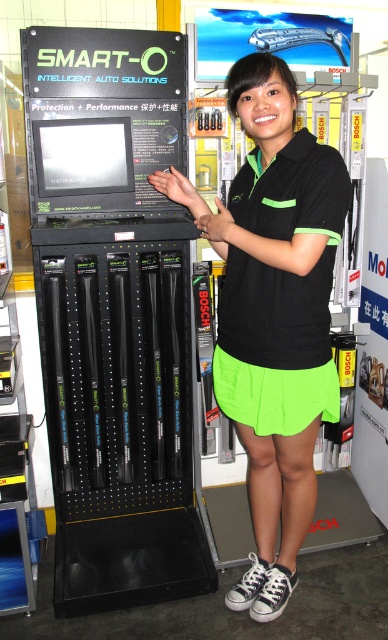
You are a fashion designer analyzing the promotional display. You notice the black matte shirt at center and the neon green fabric skirt at center. Which clothing item is higher up on the person?

The black matte shirt at center is much taller as neon green fabric skirt at center, so the black matte shirt at center is higher up on the person.

You are standing in front of the SMART O Intelligent Auto Solutions display and want to know if the point at coordinate (304, 493) is behind the point at (232, 381). Can you determine this based on the scene?

Yes, according to the scene description, point (304, 493) is behind point (232, 381).